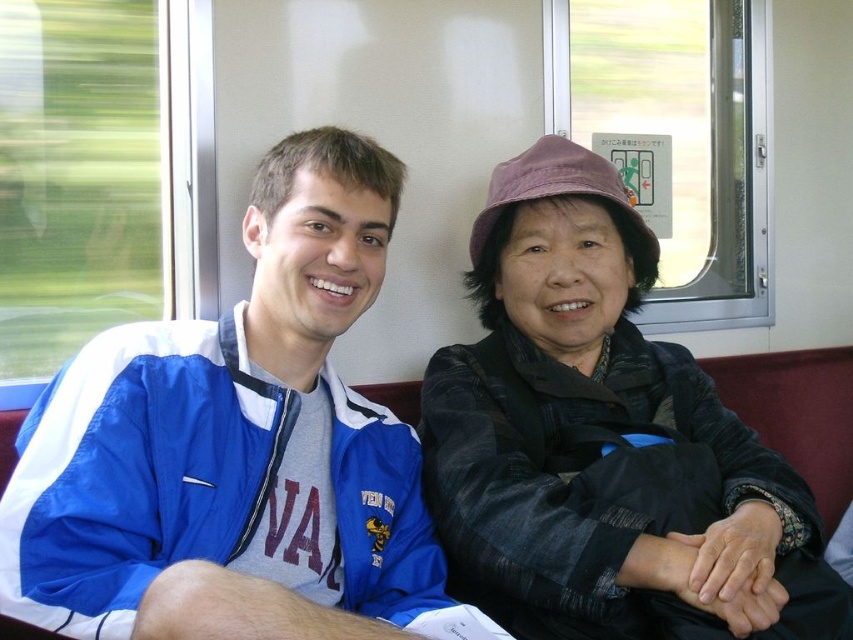
You are a photographer standing 30 inches away from a train window. You want to take a clear photo of the blue nylon jacket at left. Can you get close enough to focus on it without moving your position?

The blue nylon jacket at left is 28.51 inches away from the viewer, which is within the 30 inches distance you are currently at. Therefore, you can focus on it without moving.

You are a photographer standing in the train car and want to take a portrait of both the blue nylon jacket at left and the dark gray textured jacket at center. Given that your camera has a depth of field that can sharply focus on objects within 10 inches of each other, will both jackets be in focus?

The distance between the blue nylon jacket at left and dark gray textured jacket at center is 11.41 inches. Since the camera can only focus on objects within 10 inches of each other, the jackets are slightly too far apart to both be in sharp focus.